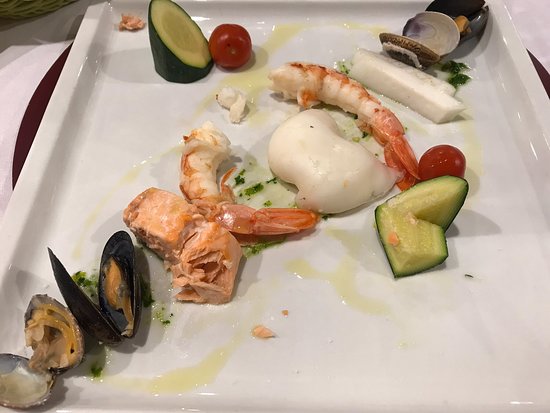
The height and width of the screenshot is (413, 550). In order to click on crumb in this screenshot , I will do `click(265, 333)`.